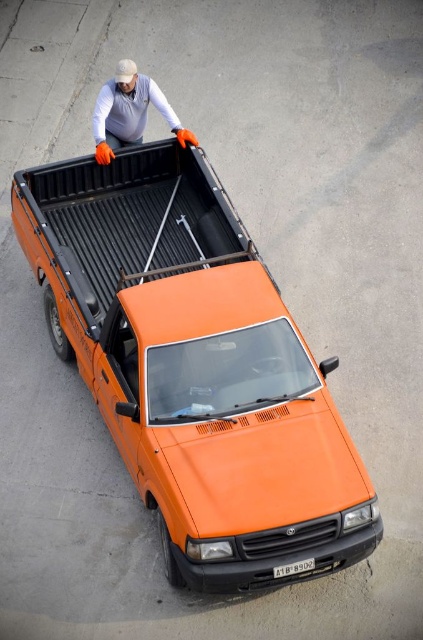
You are a delivery person who needs to load a package onto the orange matte truck at center. You are currently standing near the matte white shirt at upper center. Can you directly access the truck bed from your current position without moving around the truck?

The orange matte truck at center is in front of the matte white shirt at upper center, so you are positioned behind the truck. To access the truck bed, you would need to move around to the front side of the orange matte truck at center.

Based on the photo, you are standing at the edge of the concrete surface where the orange matte truck at center is parked. You want to place a 10 feet long ladder horizontally between you and the truck. Is there enough space to fit the ladder without it overlapping the truck?

The distance between you and the orange matte truck at center is 17.71 feet. Since the ladder is only 10 feet long, there is sufficient space to place it horizontally between you and the truck without overlapping.

Please provide the 2D coordinates of the matte white shirt at upper center in the image using the coordinate system where the bottom left corner is the origin point.

The 2D coordinates of the matte white shirt at upper center are at point (129, 112).